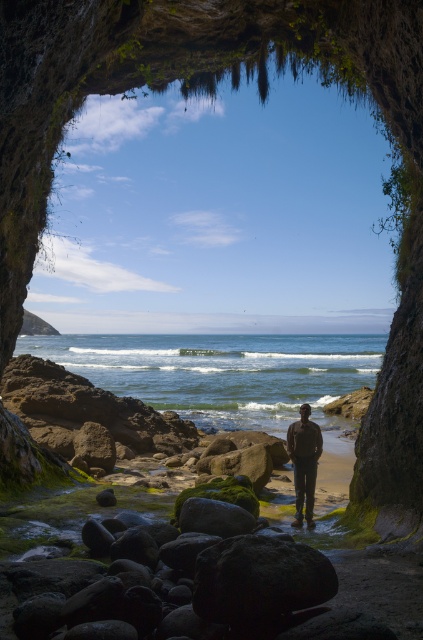
Question: Is dark matte rock at center above dark brown leather jacket at center?

Choices:
 (A) no
 (B) yes

Answer: (B)

Question: Among these objects, which one is farthest from the camera?

Choices:
 (A) dark matte rock at center
 (B) dark brown leather jacket at center

Answer: (B)

Question: Does dark matte rock at center appear under dark brown leather jacket at center?

Choices:
 (A) no
 (B) yes

Answer: (A)

Question: Which point is closer to the camera?

Choices:
 (A) (320, 433)
 (B) (225, 563)

Answer: (B)

Question: Can you confirm if dark matte rock at center is thinner than dark brown leather jacket at center?

Choices:
 (A) yes
 (B) no

Answer: (B)

Question: Which point appears closest to the camera in this image?

Choices:
 (A) (307, 506)
 (B) (238, 589)

Answer: (B)